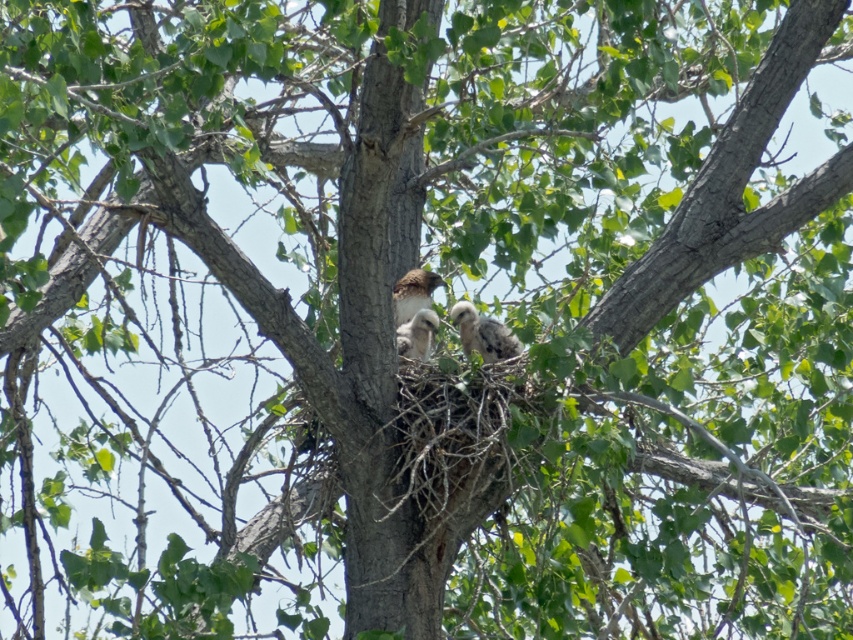
Is brown speckled feathers at center wider than speckled feathered bird at center?

Yes.

Which is below, brown speckled feathers at center or speckled feathered bird at center?

speckled feathered bird at center

Who is more forward, (396,316) or (405,339)?

Point (405,339)

Locate an element on the screen. The width and height of the screenshot is (853, 640). brown speckled feathers at center is located at coordinates (413, 292).

Which is in front, point (479, 340) or point (442, 280)?

Point (479, 340)

Who is positioned more to the left, speckled feathered chick at center or brown speckled feathers at center?

brown speckled feathers at center is more to the left.

Image resolution: width=853 pixels, height=640 pixels. What do you see at coordinates (483, 333) in the screenshot? I see `speckled feathered chick at center` at bounding box center [483, 333].

The height and width of the screenshot is (640, 853). I want to click on speckled feathered chick at center, so click(x=483, y=333).

Does speckled feathered chick at center have a larger size compared to speckled feathered bird at center?

Indeed, speckled feathered chick at center has a larger size compared to speckled feathered bird at center.

Who is taller, speckled feathered chick at center or speckled feathered bird at center?

speckled feathered chick at center is taller.

Is point (508, 342) closer to viewer compared to point (426, 333)?

Yes, point (508, 342) is in front of point (426, 333).

Locate an element on the screen. The height and width of the screenshot is (640, 853). speckled feathered chick at center is located at coordinates (483, 333).